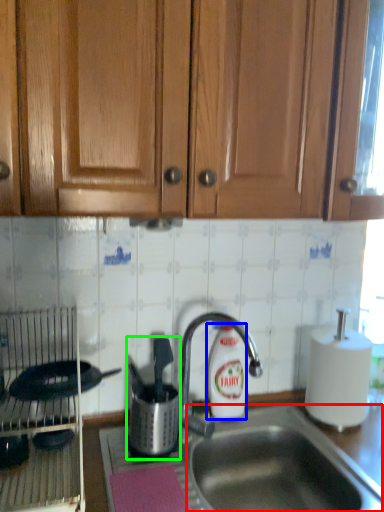
Question: Considering the real-world distances, which object is farthest from sink (highlighted by a red box)? cleaning product (highlighted by a blue box) or appliance (highlighted by a green box)?

Choices:
 (A) cleaning product
 (B) appliance

Answer: (B)